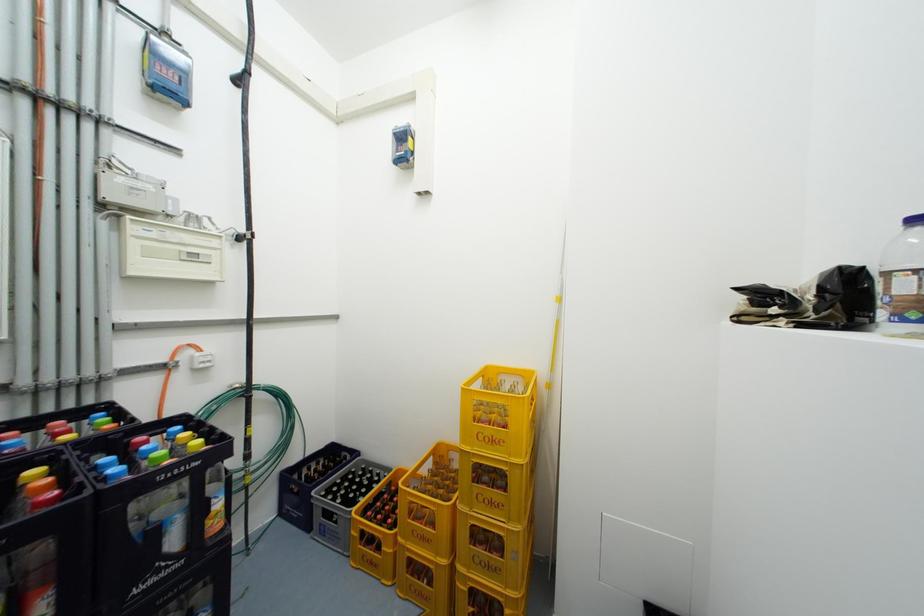
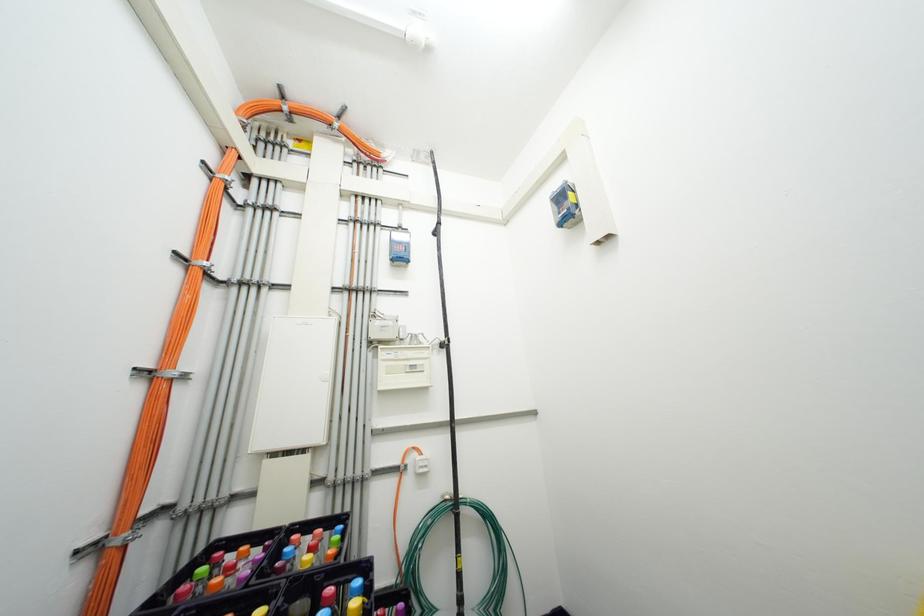
How did the camera likely rotate?

The camera rotated toward left-up.